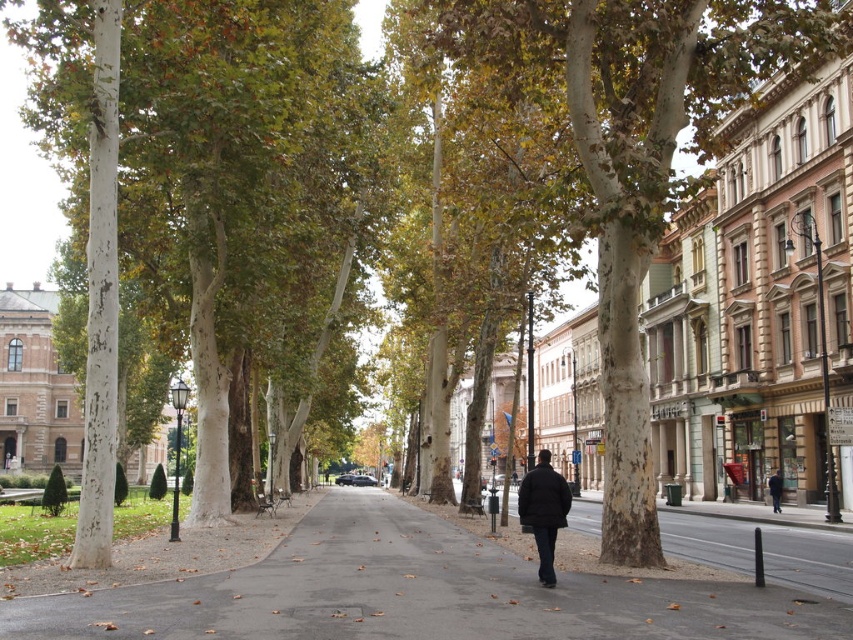
Question: Where is smooth bark tree at center located in relation to gray asphalt sidewalk at center in the image?

Choices:
 (A) above
 (B) below

Answer: (A)

Question: Does smooth bark tree at center come behind black matte coat at center?

Choices:
 (A) yes
 (B) no

Answer: (A)

Question: Is black matte coat at center bigger than dark blue coat at center?

Choices:
 (A) no
 (B) yes

Answer: (B)

Question: Considering the real-world distances, which object is farthest from the black matte coat at center?

Choices:
 (A) smooth bark tree at center
 (B) dark blue coat at center
 (C) gray asphalt sidewalk at center

Answer: (B)

Question: Which is nearer to the smooth bark tree at center?

Choices:
 (A) black matte coat at center
 (B) dark blue coat at center
 (C) gray asphalt sidewalk at center

Answer: (A)

Question: Which point appears farthest from the camera in this image?

Choices:
 (A) (773, 499)
 (B) (651, 474)

Answer: (A)